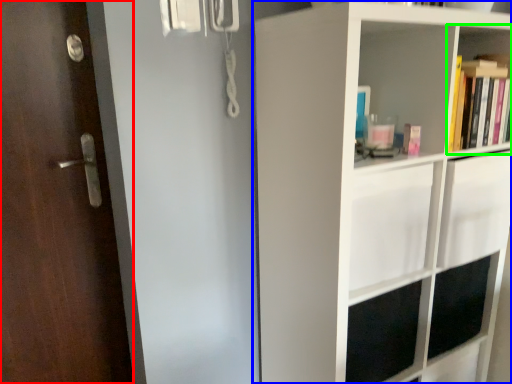
Question: Based on their relative distances, which object is nearer to door (highlighted by a red box)? Choose from shelf (highlighted by a blue box) and shelf (highlighted by a green box).

Choices:
 (A) shelf
 (B) shelf

Answer: (A)